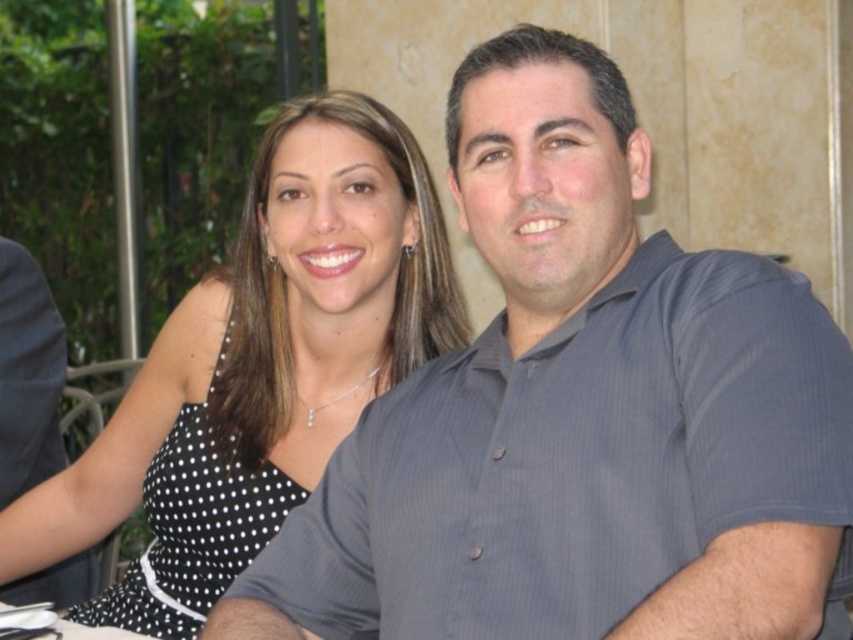
You are at a social event and see two people sitting at a table. The woman is wearing a black dotted dress at center, and the man is wearing a gray striped shirt at center. If you want to greet the man first, which side should you approach from?

The gray striped shirt at center is to the right of the black dotted dress at center, so you should approach from the right side to greet the man first.

You are a photographer trying to capture a closeup of both the gray striped shirt at center and the black dotted dress at center. Since you want to focus on both equally, which one should you adjust your camera settings to prioritize in terms of size to ensure both appear balanced in the photo?

Result: The gray striped shirt at center is larger in size than the black dotted dress at center, so you should adjust your camera settings to make the gray striped shirt at center appear smaller in the photo to balance both sizes.